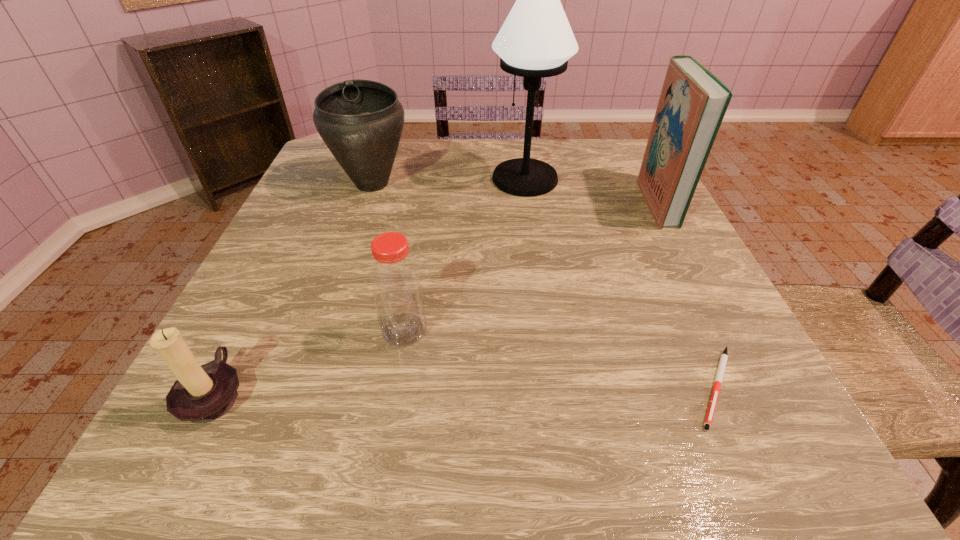
At what (x,y) coordinates should I click in order to perform the action: click on free space at the far right corner. Please return your answer as a coordinate pair (x, y). Looking at the image, I should click on (587, 145).

The width and height of the screenshot is (960, 540). Identify the location of vacant region at the near right corner of the desktop. (758, 423).

The height and width of the screenshot is (540, 960). Find the location of `free area in between the fourth tallest object and the candle holder`. free area in between the fourth tallest object and the candle holder is located at coordinates (310, 361).

I want to click on vacant space in between the table lamp and the pen, so click(620, 282).

Where is `free space that is in between the third object from right to left and the fifth shortest object`? free space that is in between the third object from right to left and the fifth shortest object is located at coordinates (591, 191).

Identify the location of free space that is in between the bottle and the fifth tallest object. The width and height of the screenshot is (960, 540). (310, 361).

Where is `unoccupied area between the urn and the pen`? unoccupied area between the urn and the pen is located at coordinates (544, 285).

This screenshot has width=960, height=540. I want to click on vacant area that lies between the urn and the shortest object, so click(x=544, y=285).

Image resolution: width=960 pixels, height=540 pixels. In order to click on vacant area between the second shortest object and the urn in this screenshot , I will do `click(294, 288)`.

Identify the location of vacant space in between the urn and the shortest object. (544, 285).